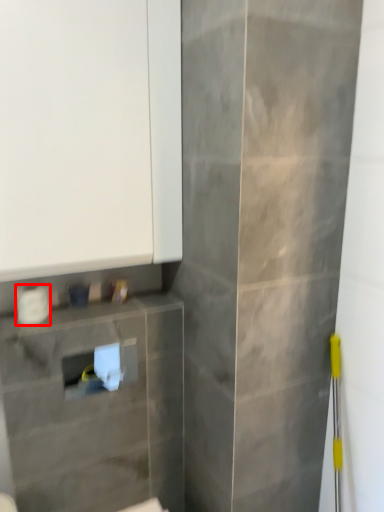
Question: From the image, what is the correct spatial relationship of toilet paper (annotated by the red box) in relation to cabinetry?

Choices:
 (A) right
 (B) left

Answer: (B)